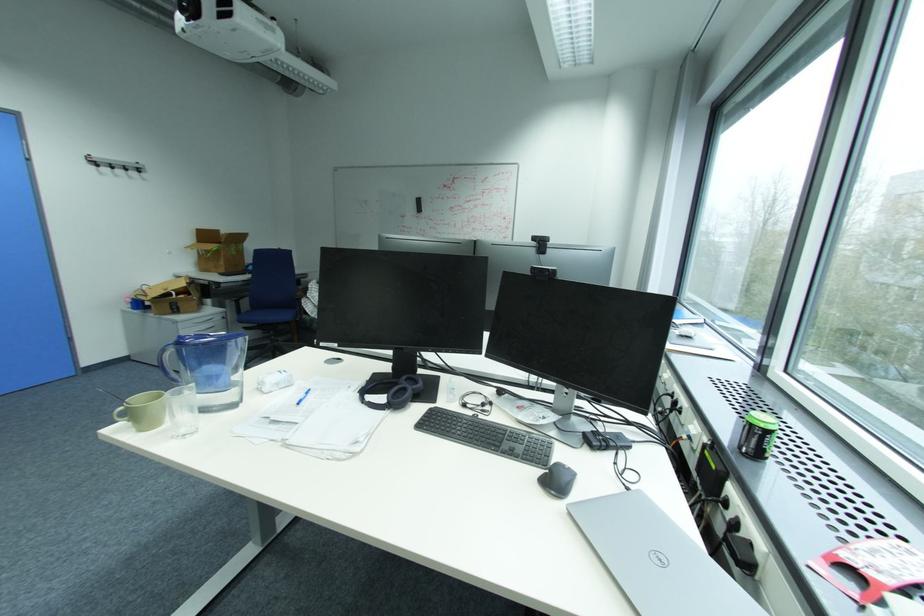
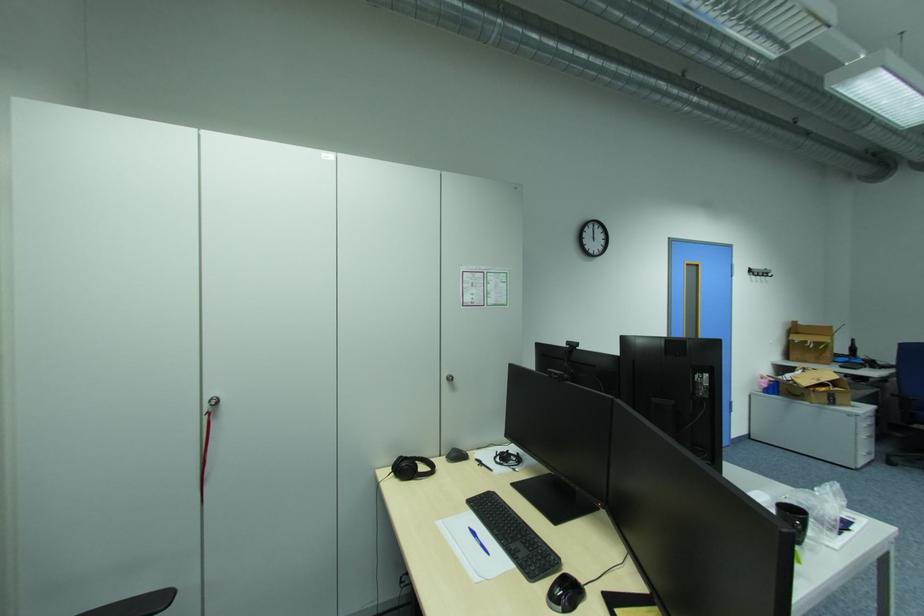
Where in the second image is the point corresponding to pixel 231 233 from the first image?

(808, 323)